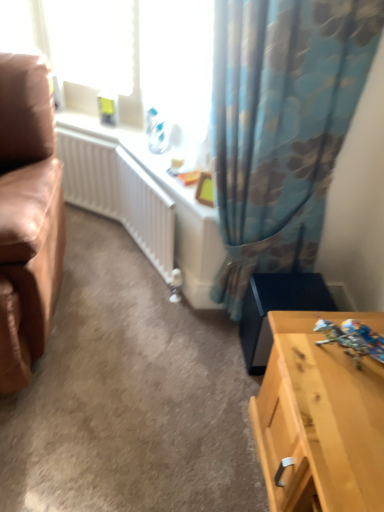
Where is `free location to the left of shiny metallic robot at lower right`? This screenshot has height=512, width=384. free location to the left of shiny metallic robot at lower right is located at coordinates (302, 348).